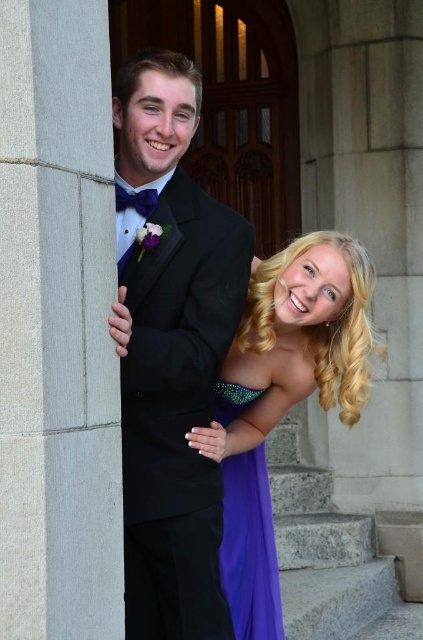
Which is in front, point (60, 445) or point (239, 378)?

Positioned in front is point (60, 445).

From the picture: Does gray stone pillar at left have a larger size compared to purple satin dress at lower right?

No, gray stone pillar at left is not bigger than purple satin dress at lower right.

Between point (76, 310) and point (228, 566), which one is positioned behind?

Positioned behind is point (228, 566).

Identify the location of gray stone pillar at left. The image size is (423, 640). coord(57,326).

Can you confirm if purple satin dress at lower right is positioned to the left of purple satin dress at center?

Incorrect, purple satin dress at lower right is not on the left side of purple satin dress at center.

Does purple satin dress at lower right appear on the right side of purple satin dress at center?

Indeed, purple satin dress at lower right is positioned on the right side of purple satin dress at center.

Who is more forward, (255, 454) or (266, 513)?

Point (266, 513) is in front.

You are a GUI agent. You are given a task and a screenshot of the screen. Output one action in this format:
    pyautogui.click(x=<x>, y=<y>)
    Task: Click on the purple satin dress at lower right
    
    Given the screenshot: What is the action you would take?
    pyautogui.click(x=282, y=397)

Is black satin tuxedo at center wider than purple satin dress at lower right?

Incorrect, black satin tuxedo at center's width does not surpass purple satin dress at lower right's.

Which is behind, point (159, 189) or point (290, 280)?

The point (290, 280) is more distant.

Find the location of a particular element. black satin tuxedo at center is located at coordinates (170, 352).

Where is `black satin tuxedo at center`? The image size is (423, 640). black satin tuxedo at center is located at coordinates (170, 352).